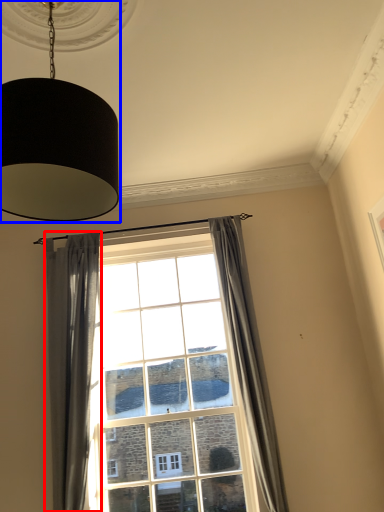
Question: Among these objects, which one is farthest to the camera, curtain (highlighted by a red box) or lamp (highlighted by a blue box)?

Choices:
 (A) curtain
 (B) lamp

Answer: (A)